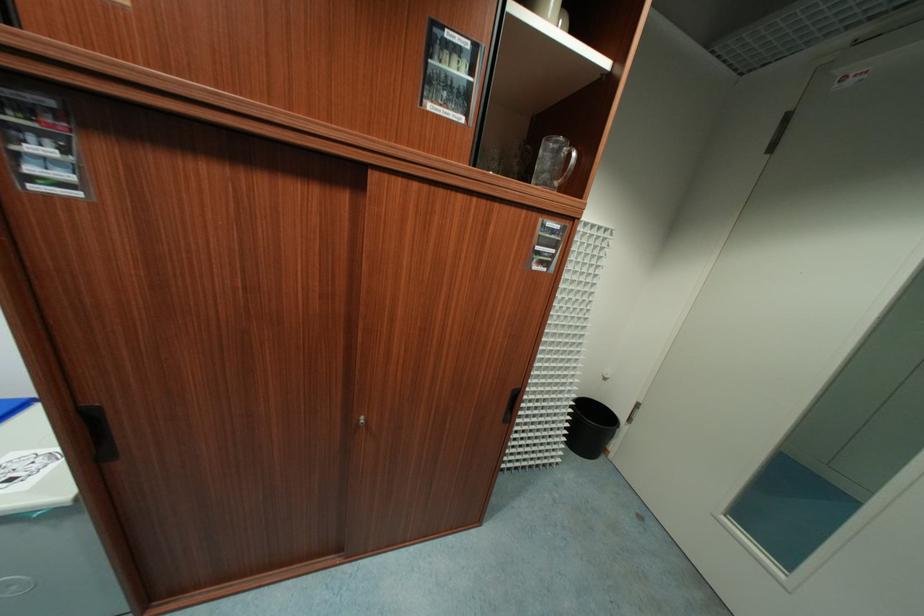
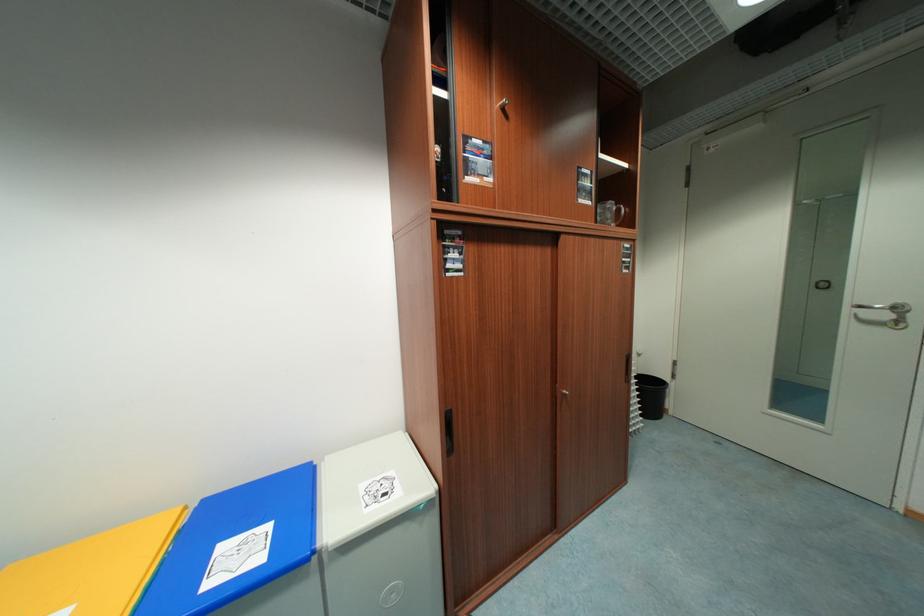
In the second image, find the point that corresponds to point 627,419 in the first image.

(672, 379)